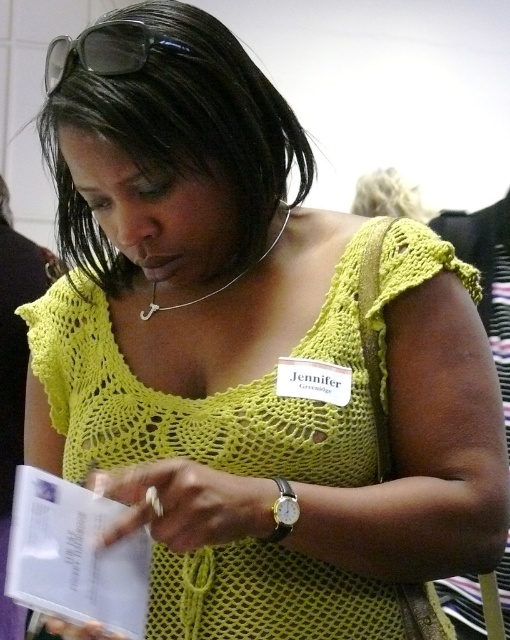
Who is positioned more to the right, white paper book at lower left or clear plastic goggles at upper center?

clear plastic goggles at upper center is more to the right.

Does white paper book at lower left have a larger size compared to clear plastic goggles at upper center?

Yes.

What do you see at coordinates (74, 556) in the screenshot? Image resolution: width=510 pixels, height=640 pixels. I see `white paper book at lower left` at bounding box center [74, 556].

Find the location of a particular element. Image resolution: width=510 pixels, height=640 pixels. white paper book at lower left is located at coordinates (74, 556).